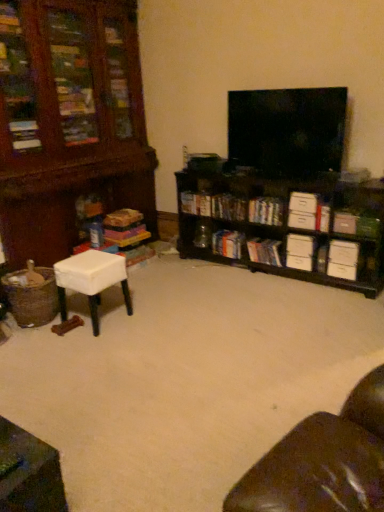
Question: Is hardcover books at center, which is the fourth book in right-to-left order, looking in the opposite direction of hardcover book at center, placed as the fifth book when sorted from right to left?

Choices:
 (A) no
 (B) yes

Answer: (A)

Question: Is the position of hardcover books at center, which is the fourth book in right-to-left order, less distant than that of hardcover book at center, placed as the fifth book when sorted from right to left?

Choices:
 (A) no
 (B) yes

Answer: (B)

Question: Can you confirm if hardcover books at center, which is the fourth book in right-to-left order, is wider than hardcover book at center, which ranks as the third book in left-to-right order?

Choices:
 (A) yes
 (B) no

Answer: (B)

Question: Does hardcover books at center, the fourth book from the left, appear on the right side of hardcover book at center, placed as the fifth book when sorted from right to left?

Choices:
 (A) no
 (B) yes

Answer: (B)

Question: From the image's perspective, is hardcover books at center, which is the fourth book in right-to-left order, located beneath hardcover book at center, which ranks as the third book in left-to-right order?

Choices:
 (A) yes
 (B) no

Answer: (A)

Question: Would you say white cardboard drawer at center right, placed as the 5th drawer when sorted from bottom to top, is inside or outside white cardboard box at center-right, which ranks as the fifth book in left-to-right order?

Choices:
 (A) inside
 (B) outside

Answer: (B)

Question: In terms of size, does white cardboard drawer at center right, placed as the 5th drawer when sorted from bottom to top, appear bigger or smaller than white cardboard box at center-right, which ranks as the third book in right-to-left order?

Choices:
 (A) small
 (B) big

Answer: (A)

Question: Considering their positions, is white cardboard drawer at center right, placed as the 5th drawer when sorted from bottom to top, located in front of or behind white cardboard box at center-right, which ranks as the third book in right-to-left order?

Choices:
 (A) behind
 (B) front

Answer: (B)

Question: In terms of height, does white cardboard drawer at center right, placed as the 5th drawer when sorted from bottom to top, look taller or shorter compared to white cardboard box at center-right, which ranks as the fifth book in left-to-right order?

Choices:
 (A) short
 (B) tall

Answer: (A)

Question: Is hardcover books at center, the fourth book from the left, wider or thinner than white cardboard drawer at lower right, placed as the fourth drawer when sorted from top to bottom?

Choices:
 (A) thin
 (B) wide

Answer: (B)

Question: Does point pos(278,247) appear closer or farther from the camera than point pos(292,266)?

Choices:
 (A) farther
 (B) closer

Answer: (A)

Question: Would you say hardcover books at center, the fourth book from the left, is to the left or to the right of white cardboard drawer at lower right, placed as the fourth drawer when sorted from top to bottom, in the picture?

Choices:
 (A) right
 (B) left

Answer: (B)

Question: Is hardcover books at center, the fourth book from the left, inside or outside of white cardboard drawer at lower right, which appears as the 2th drawer when ordered from the bottom?

Choices:
 (A) inside
 (B) outside

Answer: (B)

Question: From a real-world perspective, is white cardboard box at center-right, which ranks as the third book in right-to-left order, physically located above or below black wood shelf at center right?

Choices:
 (A) above
 (B) below

Answer: (A)

Question: Is white cardboard box at center-right, which ranks as the third book in right-to-left order, to the left or to the right of black wood shelf at center right in the image?

Choices:
 (A) right
 (B) left

Answer: (B)